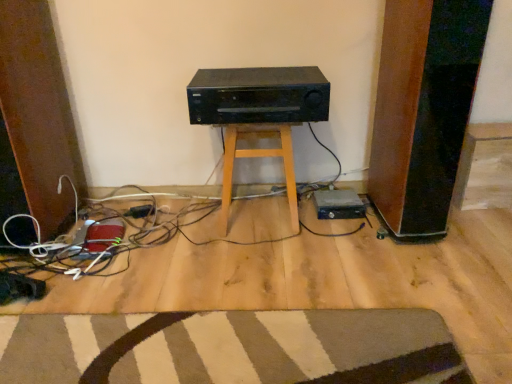
Locate an element on the screen. vacant space in between black plastic hard drive at lower right and striped carpet at lower center is located at coordinates (261, 270).